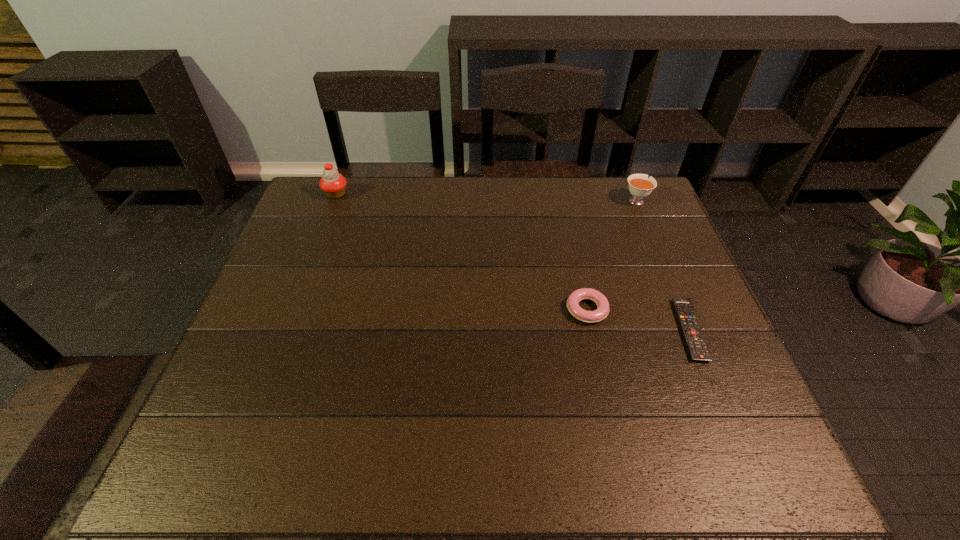
The width and height of the screenshot is (960, 540). I want to click on vacant space at the left edge of the desktop, so click(x=290, y=297).

Find the location of a particular element. Image resolution: width=960 pixels, height=540 pixels. free region at the right edge of the desktop is located at coordinates (666, 348).

Where is `free spot at the far left corner of the desktop`? The width and height of the screenshot is (960, 540). free spot at the far left corner of the desktop is located at coordinates (323, 211).

In order to click on vacant area at the near left corner of the desktop in this screenshot , I will do `click(275, 440)`.

In the image, there is a desktop. At what (x,y) coordinates should I click in order to perform the action: click on vacant space at the far right corner. Please return your answer as a coordinate pair (x, y). Looking at the image, I should click on (629, 196).

Locate an element on the screen. This screenshot has height=540, width=960. free spot between the cupcake and the second shortest object is located at coordinates (462, 252).

The height and width of the screenshot is (540, 960). Find the location of `free point between the tallest object and the third object from right to left`. free point between the tallest object and the third object from right to left is located at coordinates (462, 252).

Where is `vacant area that lies between the shortest object and the doughnut`? vacant area that lies between the shortest object and the doughnut is located at coordinates (638, 320).

The image size is (960, 540). I want to click on free spot between the third object from right to left and the cupcake, so click(462, 252).

You are a GUI agent. You are given a task and a screenshot of the screen. Output one action in this format:
    pyautogui.click(x=<x>, y=<y>)
    Task: Click on the free spot between the teacup and the tallest object
    
    Given the screenshot: What is the action you would take?
    pyautogui.click(x=486, y=197)